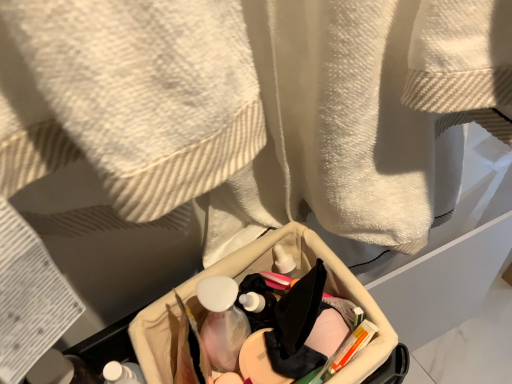
Measure the distance between beige fabric basket at center and camera.

15.28 inches.

The width and height of the screenshot is (512, 384). Describe the element at coordinates (122, 373) in the screenshot. I see `white matte bottle at lower left` at that location.

Find the location of a particular element. translucent plastic mouthwash at center is located at coordinates (222, 322).

From a real-world perspective, which object rests below the other?

From a 3D spatial view, translucent plastic mouthwash at center is below.

Is translucent plastic mouthwash at center positioned with its back to beige fabric basket at center?

Absolutely, translucent plastic mouthwash at center is directed away from beige fabric basket at center.

In the scene shown: Between translucent plastic mouthwash at center and beige fabric basket at center, which one has smaller width?

translucent plastic mouthwash at center is thinner.

Which is further, (227, 350) or (170, 366)?

Point (170, 366)

Is translucent plastic mouthwash at center facing towards white matte bottle at lower left?

No, translucent plastic mouthwash at center is not aimed at white matte bottle at lower left.

From the image's perspective, who appears lower, translucent plastic mouthwash at center or white matte bottle at lower left?

white matte bottle at lower left, from the image's perspective.

Which is in front, translucent plastic mouthwash at center or white matte bottle at lower left?

Positioned in front is white matte bottle at lower left.

From a real-world perspective, is translucent plastic mouthwash at center under white matte bottle at lower left?

Yes, from a real-world perspective, translucent plastic mouthwash at center is below white matte bottle at lower left.

Where is `storage box lying on the right of white matte bottle at lower left`? This screenshot has height=384, width=512. storage box lying on the right of white matte bottle at lower left is located at coordinates (305, 271).

Consider the image. From a real-world perspective, is white matte bottle at lower left under beige fabric basket at center?

No, from a real-world perspective, white matte bottle at lower left is not beneath beige fabric basket at center.

Can you confirm if white matte bottle at lower left is wider than beige fabric basket at center?

Incorrect, the width of white matte bottle at lower left does not surpass that of beige fabric basket at center.

Is white matte bottle at lower left outside of translucent plastic mouthwash at center?

Indeed, white matte bottle at lower left is completely outside translucent plastic mouthwash at center.

Can you confirm if white matte bottle at lower left is thinner than translucent plastic mouthwash at center?

In fact, white matte bottle at lower left might be wider than translucent plastic mouthwash at center.

From the picture: Which object is further away from the camera, white matte bottle at lower left or translucent plastic mouthwash at center?

translucent plastic mouthwash at center is further away from the camera.

Looking at the image, does white matte bottle at lower left seem bigger or smaller compared to translucent plastic mouthwash at center?

In the image, white matte bottle at lower left appears to be larger than translucent plastic mouthwash at center.

Looking at this image, between beige fabric basket at center and white matte bottle at lower left, which one has larger width?

beige fabric basket at center is wider.

From the image's perspective, which is above, beige fabric basket at center or white matte bottle at lower left?

beige fabric basket at center, from the image's perspective.

Is beige fabric basket at center aimed at white matte bottle at lower left?

No, beige fabric basket at center is not turned towards white matte bottle at lower left.

The height and width of the screenshot is (384, 512). Identify the location of storage box located on the right of white matte bottle at lower left. (305, 271).

In the scene shown: From the image's perspective, which one is positioned lower, beige fabric basket at center or translucent plastic mouthwash at center?

beige fabric basket at center.

Is beige fabric basket at center inside the boundaries of translucent plastic mouthwash at center, or outside?

beige fabric basket at center is not inside translucent plastic mouthwash at center, it's outside.

Is beige fabric basket at center behind translucent plastic mouthwash at center?

No, beige fabric basket at center is closer to the camera.

Does beige fabric basket at center have a lesser width compared to translucent plastic mouthwash at center?

In fact, beige fabric basket at center might be wider than translucent plastic mouthwash at center.

At what (x,y) coordinates should I click in order to perform the action: click on mouthwash above the beige fabric basket at center (from the image's perspective). Please return your answer as a coordinate pair (x, y). This screenshot has width=512, height=384. Looking at the image, I should click on (222, 322).

The image size is (512, 384). What are the coordinates of `toiletry below the translucent plastic mouthwash at center (from the image's perspective)` in the screenshot? It's located at (122, 373).

Considering their positions, is translucent plastic mouthwash at center positioned closer to white matte bottle at lower left than beige fabric basket at center?

translucent plastic mouthwash at center is positioned closer to the anchor white matte bottle at lower left.

Which object lies further to the anchor point translucent plastic mouthwash at center, white matte bottle at lower left or beige fabric basket at center?

Among the two, white matte bottle at lower left is located further to translucent plastic mouthwash at center.

When comparing their distances from beige fabric basket at center, does white matte bottle at lower left or translucent plastic mouthwash at center seem closer?

Among the two, translucent plastic mouthwash at center is located nearer to beige fabric basket at center.

Looking at the image, which one is located closer to white matte bottle at lower left, beige fabric basket at center or translucent plastic mouthwash at center?

translucent plastic mouthwash at center.

Looking at the image, which one is located closer to translucent plastic mouthwash at center, beige fabric basket at center or white matte bottle at lower left?

beige fabric basket at center lies closer to translucent plastic mouthwash at center than the other object.

When comparing their distances from beige fabric basket at center, does translucent plastic mouthwash at center or white matte bottle at lower left seem further?

Among the two, white matte bottle at lower left is located further to beige fabric basket at center.

Locate an element on the screen. storage box between white matte bottle at lower left and translucent plastic mouthwash at center along the z-axis is located at coordinates (305, 271).